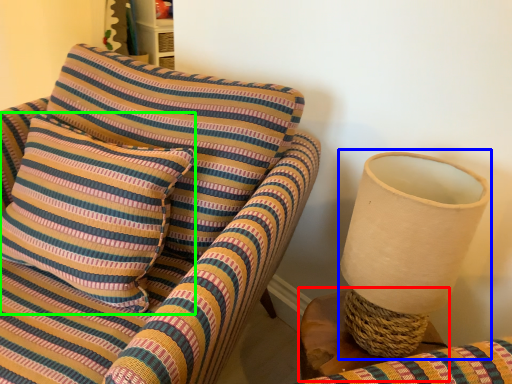
Question: Which object is positioned farthest from table (highlighted by a red box)? Select from table lamp (highlighted by a blue box) and pillow (highlighted by a green box).

Choices:
 (A) table lamp
 (B) pillow

Answer: (B)